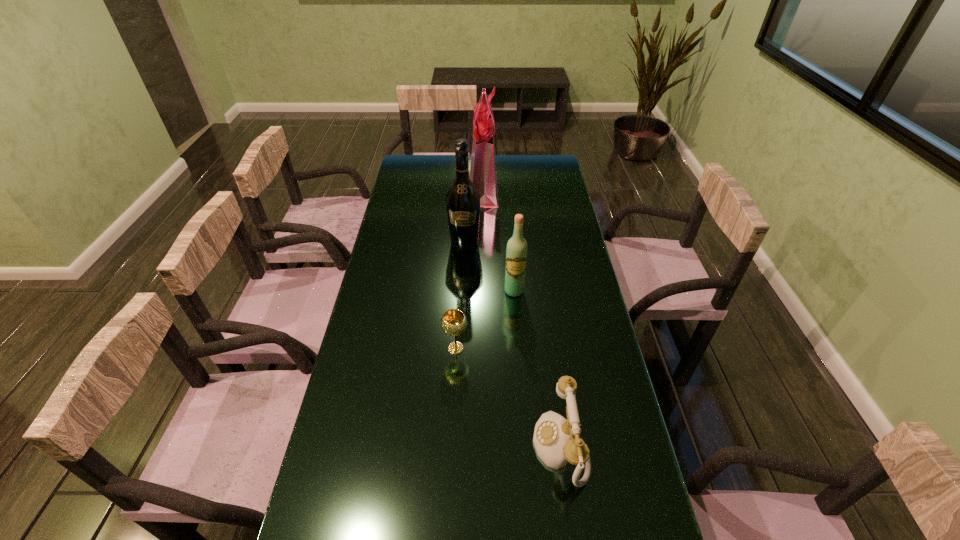
Identify the location of free space between the shorter wine bottle and the nearest object. The width and height of the screenshot is (960, 540). (538, 368).

Where is `free spot between the chalice and the taller wine bottle`? free spot between the chalice and the taller wine bottle is located at coordinates (460, 296).

Identify the location of vacant area between the farthest object and the nearest object. The width and height of the screenshot is (960, 540). (522, 317).

I want to click on vacant point located between the nearest object and the farthest object, so click(522, 317).

You are a GUI agent. You are given a task and a screenshot of the screen. Output one action in this format:
    pyautogui.click(x=<x>, y=<y>)
    Task: Click on the free space between the left wine bottle and the chalice
    
    Given the screenshot: What is the action you would take?
    point(460,296)

Where is `free space between the chalice and the telephone`? Image resolution: width=960 pixels, height=540 pixels. free space between the chalice and the telephone is located at coordinates (508, 397).

At what (x,y) coordinates should I click in order to perform the action: click on empty space that is in between the second farthest object and the chalice. Please return your answer as a coordinate pair (x, y). The image size is (960, 540). Looking at the image, I should click on (460, 296).

At what (x,y) coordinates should I click in order to perform the action: click on free space between the telephone and the shorter wine bottle. Please return your answer as a coordinate pair (x, y). Image resolution: width=960 pixels, height=540 pixels. Looking at the image, I should click on (538, 368).

Find the location of `free point between the chalice and the left wine bottle`. free point between the chalice and the left wine bottle is located at coordinates (460, 296).

Select which object appears as the second closest to the shopping bag. Please provide its 2D coordinates. Your answer should be formatted as a tuple, i.e. [(x, y)], where the tuple contains the x and y coordinates of a point satisfying the conditions above.

[(516, 252)]